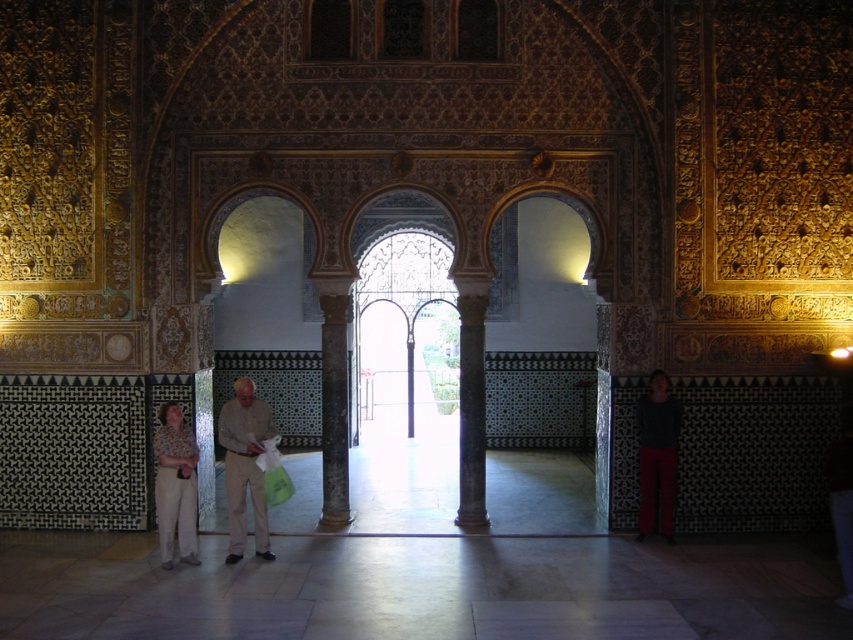
Question: Does light beige pants at lower left have a lesser width compared to dark gray sweater at right?

Choices:
 (A) yes
 (B) no

Answer: (B)

Question: Can you confirm if dark gray sweater at right is bigger than metallic silver pillar at center?

Choices:
 (A) yes
 (B) no

Answer: (A)

Question: Which object appears closest to the camera in this image?

Choices:
 (A) black marble column at center
 (B) dark gray stone column at center
 (C) dark gray sweater at right

Answer: (C)

Question: Which of the following is the farthest from the observer?

Choices:
 (A) (340, 412)
 (B) (254, 522)

Answer: (A)

Question: Is black marble column at center to the right of dark gray sweater at right from the viewer's perspective?

Choices:
 (A) yes
 (B) no

Answer: (B)

Question: Considering the real-world distances, which object is farthest from the dark gray sweater at right?

Choices:
 (A) polished marble pillar at center
 (B) light brown leather pants at center
 (C) dark gray stone column at center
 (D) metallic silver pillar at center

Answer: (D)